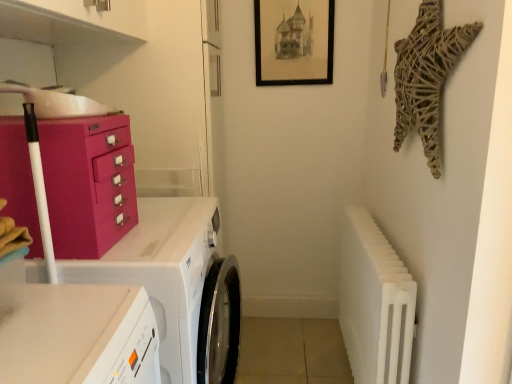
Question: In the image, is white glossy washing machine at lower left on the left side or the right side of matte pink cabinet at left?

Choices:
 (A) right
 (B) left

Answer: (A)

Question: Do you think white glossy washing machine at lower left is within matte pink cabinet at left, or outside of it?

Choices:
 (A) outside
 (B) inside

Answer: (A)

Question: Which object is the farthest from the matte pink cabinet at left?

Choices:
 (A) black matte picture frame at upper center
 (B) white ribbed radiator at right
 (C) white glossy washing machine at lower left

Answer: (A)

Question: Based on their relative distances, which object is nearer to the matte pink cabinet at left?

Choices:
 (A) black matte picture frame at upper center
 (B) white glossy washing machine at lower left
 (C) white ribbed radiator at right

Answer: (B)